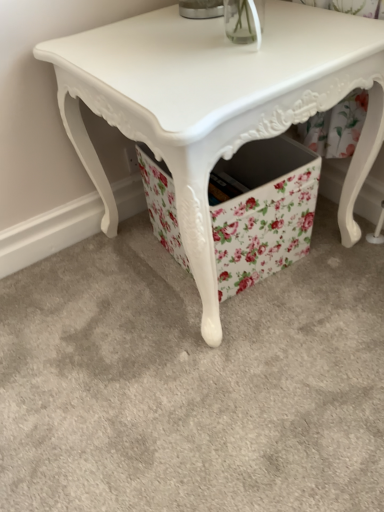
Where is `floral fabric storage box at lower center`? The image size is (384, 512). floral fabric storage box at lower center is located at coordinates (262, 211).

The height and width of the screenshot is (512, 384). What do you see at coordinates (262, 211) in the screenshot? I see `floral fabric storage box at lower center` at bounding box center [262, 211].

The width and height of the screenshot is (384, 512). Describe the element at coordinates (216, 104) in the screenshot. I see `white glossy table at center` at that location.

What is the approximate height of white glossy table at center?

white glossy table at center is 24.23 inches in height.

In order to face white glossy table at center, should I rotate leftwards or rightwards?

To align with it, rotate right about 3.397°.

The width and height of the screenshot is (384, 512). I want to click on white glossy table at center, so click(x=216, y=104).

Find the location of `floral fabric storage box at lower center`. floral fabric storage box at lower center is located at coordinates point(262,211).

Can you confirm if white glossy table at center is positioned to the left of floral fabric storage box at lower center?

Yes.

Is white glossy table at center in front of or behind floral fabric storage box at lower center in the image?

Visually, white glossy table at center is located in front of floral fabric storage box at lower center.

Does point (164, 143) appear closer or farther from the camera than point (272, 184)?

Clearly, point (164, 143) is closer to the camera than point (272, 184).

From the image's perspective, is white glossy table at center located above floral fabric storage box at lower center?

Yes.

From a real-world perspective, relative to floral fabric storage box at lower center, is white glossy table at center vertically above or below?

white glossy table at center is above floral fabric storage box at lower center.

In the scene shown: Between white glossy table at center and floral fabric storage box at lower center, which one has smaller width?

floral fabric storage box at lower center.

Does white glossy table at center have a greater height compared to floral fabric storage box at lower center?

Correct, white glossy table at center is much taller as floral fabric storage box at lower center.

Is white glossy table at center bigger than floral fabric storage box at lower center?

Yes, white glossy table at center is bigger than floral fabric storage box at lower center.

Is white glossy table at center not within floral fabric storage box at lower center?

Indeed, white glossy table at center is completely outside floral fabric storage box at lower center.

Is white glossy table at center in contact with floral fabric storage box at lower center?

No, white glossy table at center is not beside floral fabric storage box at lower center.

Is white glossy table at center turned away from floral fabric storage box at lower center?

That's right, white glossy table at center is facing away from floral fabric storage box at lower center.

How different are the orientations of white glossy table at center and floral fabric storage box at lower center in degrees?

The angle between the facing direction of white glossy table at center and the facing direction of floral fabric storage box at lower center is 5.57 degrees.

At what (x,y) coordinates should I click in order to perform the action: click on table located above the floral fabric storage box at lower center (from a real-world perspective). Please return your answer as a coordinate pair (x, y). This screenshot has height=512, width=384. Looking at the image, I should click on pos(216,104).

Can you confirm if floral fabric storage box at lower center is positioned to the right of white glossy table at center?

Yes, floral fabric storage box at lower center is to the right of white glossy table at center.

Which is in front, floral fabric storage box at lower center or white glossy table at center?

Positioned in front is white glossy table at center.

Does point (264, 194) appear closer or farther from the camera than point (325, 18)?

Point (264, 194) is positioned farther from the camera compared to point (325, 18).

From the image's perspective, is floral fabric storage box at lower center above or below white glossy table at center?

From the image's perspective, floral fabric storage box at lower center appears below white glossy table at center.

From a real-world perspective, does floral fabric storage box at lower center sit lower than white glossy table at center?

Yes, from a real-world perspective, floral fabric storage box at lower center is below white glossy table at center.

Considering the sizes of floral fabric storage box at lower center and white glossy table at center in the image, is floral fabric storage box at lower center wider or thinner than white glossy table at center?

Considering their sizes, floral fabric storage box at lower center looks slimmer than white glossy table at center.

Between floral fabric storage box at lower center and white glossy table at center, which one has less height?

floral fabric storage box at lower center is shorter.

Who is smaller, floral fabric storage box at lower center or white glossy table at center?

floral fabric storage box at lower center is smaller.

Can we say floral fabric storage box at lower center lies outside white glossy table at center?

No.

Can you see floral fabric storage box at lower center touching white glossy table at center?

There is a gap between floral fabric storage box at lower center and white glossy table at center.

Is floral fabric storage box at lower center facing away from white glossy table at center?

Yes, white glossy table at center is at the back of floral fabric storage box at lower center.

How far apart are floral fabric storage box at lower center and white glossy table at center?

floral fabric storage box at lower center and white glossy table at center are 7.91 inches apart from each other.

The image size is (384, 512). In order to click on table above the floral fabric storage box at lower center (from a real-world perspective) in this screenshot , I will do `click(216, 104)`.

Where is `storage box that appears below the white glossy table at center (from the image's perspective)`? storage box that appears below the white glossy table at center (from the image's perspective) is located at coordinates tap(262, 211).

At what (x,y) coordinates should I click in order to perform the action: click on table on the left of floral fabric storage box at lower center. Please return your answer as a coordinate pair (x, y). Looking at the image, I should click on (216, 104).